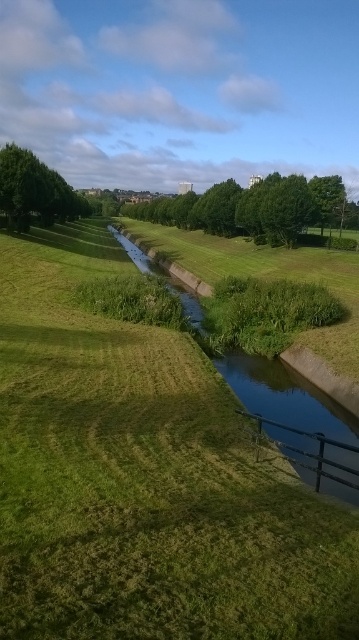
Question: Does green grassy at center appear over green grassy stream at center?

Choices:
 (A) yes
 (B) no

Answer: (B)

Question: Estimate the real-world distances between objects in this image. Which object is farther from the green grassy stream at center?

Choices:
 (A) green leafy tree at center
 (B) green grassy at center
 (C) green leafy tree at upper left

Answer: (A)

Question: Does green grassy stream at center have a lesser width compared to green leafy tree at center?

Choices:
 (A) no
 (B) yes

Answer: (B)

Question: Considering the relative positions of green grassy stream at center and green leafy tree at center in the image provided, where is green grassy stream at center located with respect to green leafy tree at center?

Choices:
 (A) below
 (B) above

Answer: (A)

Question: Which of the following is the farthest from the observer?

Choices:
 (A) green grassy stream at center
 (B) green grassy at center
 (C) green leafy tree at center
 (D) green leafy tree at upper left

Answer: (C)

Question: Which of the following is the closest to the observer?

Choices:
 (A) (175, 291)
 (B) (53, 337)
 (C) (54, 173)
 (D) (278, 176)

Answer: (B)